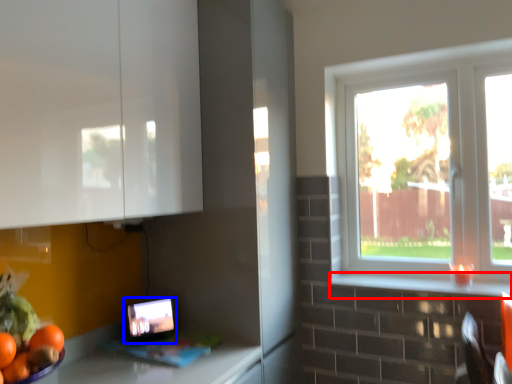
Question: Which object is further to the camera taking this photo, window sill (highlighted by a red box) or tablet computer (highlighted by a blue box)?

Choices:
 (A) window sill
 (B) tablet computer

Answer: (B)